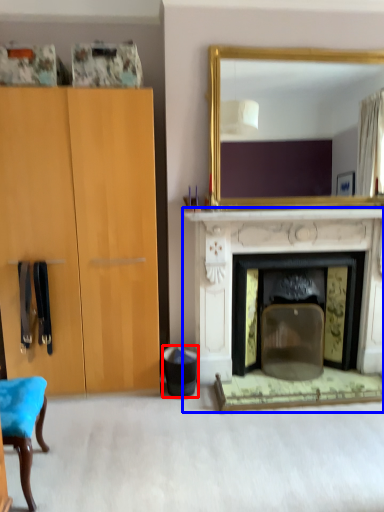
Question: Which object appears closest to the camera in this image, trash bin/can (highlighted by a red box) or fireplace (highlighted by a blue box)?

Choices:
 (A) trash bin/can
 (B) fireplace

Answer: (B)